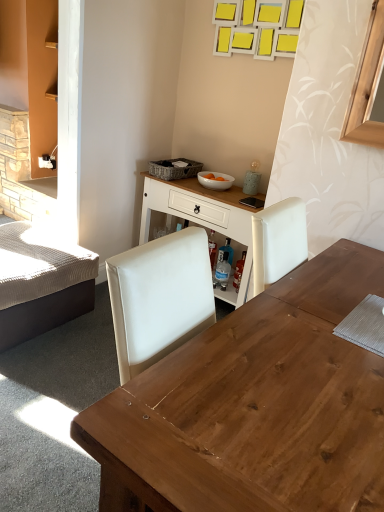
Question: Is woven gray picnic basket at upper center aimed at white wood table at center?

Choices:
 (A) yes
 (B) no

Answer: (B)

Question: Is woven gray picnic basket at upper center smaller than white wood table at center?

Choices:
 (A) yes
 (B) no

Answer: (A)

Question: From the image's perspective, does woven gray picnic basket at upper center appear lower than white wood table at center?

Choices:
 (A) yes
 (B) no

Answer: (B)

Question: Considering the relative positions of woven gray picnic basket at upper center and white wood table at center in the image provided, is woven gray picnic basket at upper center behind white wood table at center?

Choices:
 (A) yes
 (B) no

Answer: (A)

Question: Is woven gray picnic basket at upper center facing away from white wood table at center?

Choices:
 (A) no
 (B) yes

Answer: (A)

Question: Does woven gray picnic basket at upper center have a lesser width compared to white wood table at center?

Choices:
 (A) yes
 (B) no

Answer: (B)

Question: Is wooden desk at center at the right side of textured beige bed at left?

Choices:
 (A) no
 (B) yes

Answer: (B)

Question: Is wooden desk at center looking in the opposite direction of textured beige bed at left?

Choices:
 (A) yes
 (B) no

Answer: (B)

Question: Is wooden desk at center thinner than textured beige bed at left?

Choices:
 (A) yes
 (B) no

Answer: (B)

Question: Does wooden desk at center have a greater width compared to textured beige bed at left?

Choices:
 (A) no
 (B) yes

Answer: (B)

Question: Is wooden desk at center shorter than textured beige bed at left?

Choices:
 (A) yes
 (B) no

Answer: (B)

Question: Is wooden desk at center at the left side of textured beige bed at left?

Choices:
 (A) no
 (B) yes

Answer: (A)

Question: From the image's perspective, is woven gray picnic basket at upper center located beneath textured beige bed at left?

Choices:
 (A) no
 (B) yes

Answer: (A)